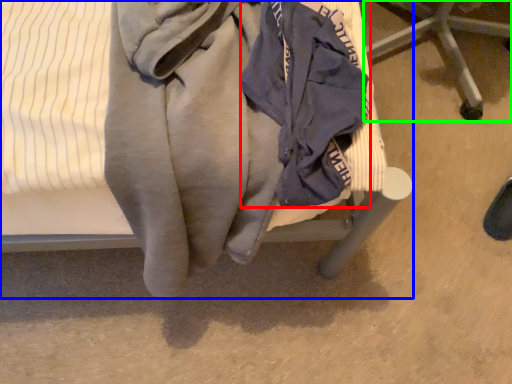
Question: Estimate the real-world distances between objects in this image. Which object is closer to garment (highlighted by a red box), furniture (highlighted by a blue box) or furniture (highlighted by a green box)?

Choices:
 (A) furniture
 (B) furniture

Answer: (A)